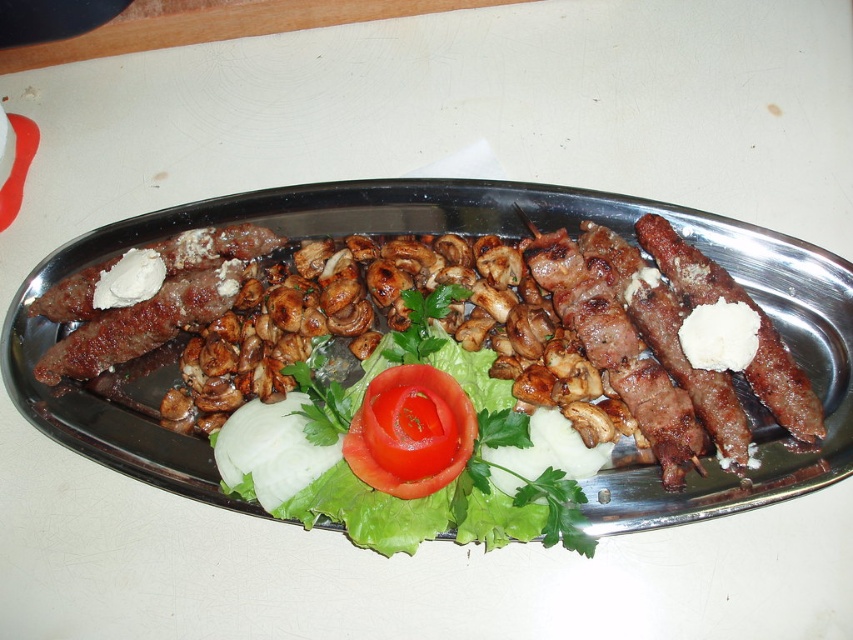
You are a food critic standing 4 feet away from the red glossy tomato at center on the plate. Can you reach it without moving closer?

The red glossy tomato at center is 3.72 feet away from the camera, which is less than 4 feet. Therefore, you can reach it without moving closer.

You are a food critic sitting at a table with this dish in front of you. You want to take a bite of the red glossy tomato at center. Can you reach it without moving your hand more than 1 meter forward?

The red glossy tomato at center is 1.13 meters from viewer, which is further than 1 meter. You cannot reach it without moving your hand more than 1 meter forward.